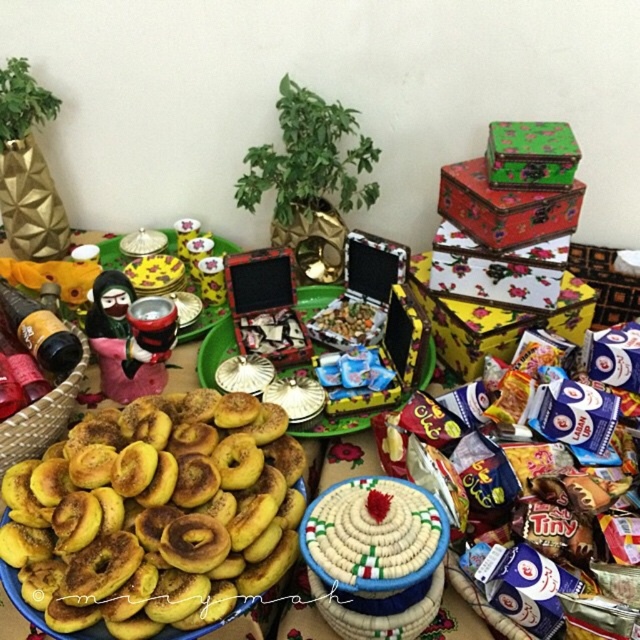
Does yellow matte plate at center have a larger size compared to green painted wood box at upper right?

Indeed, yellow matte plate at center has a larger size compared to green painted wood box at upper right.

Which is behind, point (163, 637) or point (540, 134)?

The point (540, 134) is more distant.

Locate an element on the screen. yellow matte plate at center is located at coordinates (156, 515).

Is yellow matte plate at center above golden brown doughnut at lower left?

Yes, yellow matte plate at center is above golden brown doughnut at lower left.

You are a GUI agent. You are given a task and a screenshot of the screen. Output one action in this format:
    pyautogui.click(x=<x>, y=<y>)
    Task: Click on the yellow matte plate at center
    
    Given the screenshot: What is the action you would take?
    pyautogui.click(x=156, y=515)

Find the location of `yellow matte plate at center`. yellow matte plate at center is located at coordinates (156, 515).

What do you see at coordinates (156, 515) in the screenshot?
I see `golden brown doughnut at lower left` at bounding box center [156, 515].

Does golden brown doughnut at lower left have a larger size compared to shiny metallic tray at center?

Indeed, golden brown doughnut at lower left has a larger size compared to shiny metallic tray at center.

Which is behind, point (186, 438) or point (376, 308)?

The point (376, 308) is more distant.

This screenshot has height=640, width=640. I want to click on golden brown doughnut at lower left, so click(x=156, y=515).